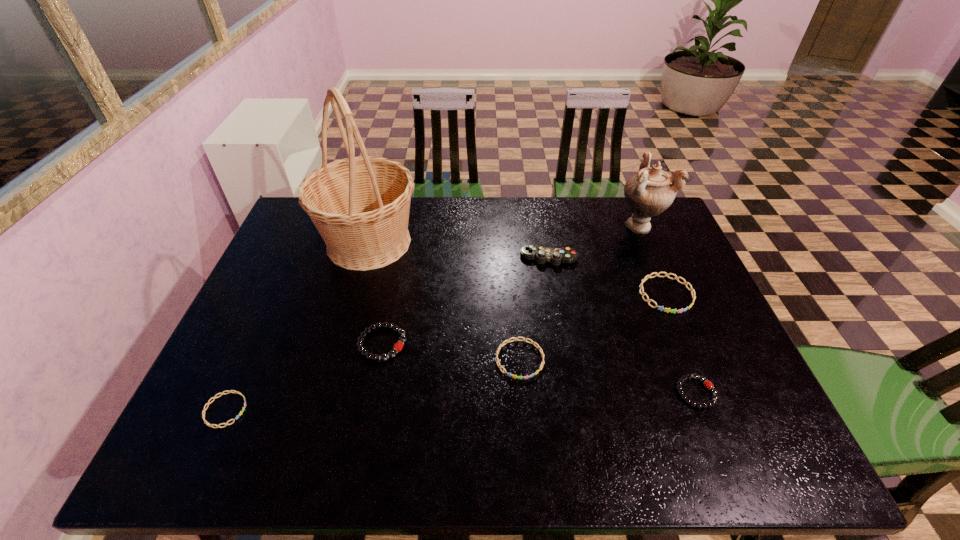
The width and height of the screenshot is (960, 540). In order to click on vacant space situated on the surface of the shortest bracelet showing star-shaped elements in this screenshot , I will do `click(362, 410)`.

What are the coordinates of `basket positioned at the far edge` in the screenshot? It's located at (360, 205).

Find the location of a particular element. urn positioned at the far edge is located at coordinates (648, 193).

You are a GUI agent. You are given a task and a screenshot of the screen. Output one action in this format:
    pyautogui.click(x=<x>, y=<y>)
    Task: Click on the object that is at the near edge
    
    Given the screenshot: What is the action you would take?
    pyautogui.click(x=243, y=408)

You are a GUI agent. You are given a task and a screenshot of the screen. Output one action in this format:
    pyautogui.click(x=<x>, y=<y>)
    Task: Click on the basket that is at the left edge
    
    Given the screenshot: What is the action you would take?
    pyautogui.click(x=360, y=205)

At what (x,y) coordinates should I click in order to perform the action: click on bracelet present at the left edge. Please return your answer as a coordinate pair (x, y). Image resolution: width=960 pixels, height=540 pixels. Looking at the image, I should click on (243, 408).

Find the location of a particular element. urn that is at the right edge is located at coordinates (648, 193).

In order to click on object that is positioned at the far left corner in this screenshot , I will do `click(360, 205)`.

Locate an element on the screen. This screenshot has width=960, height=540. object positioned at the near left corner is located at coordinates (243, 408).

Where is `object that is at the far right corner`? This screenshot has height=540, width=960. object that is at the far right corner is located at coordinates (648, 193).